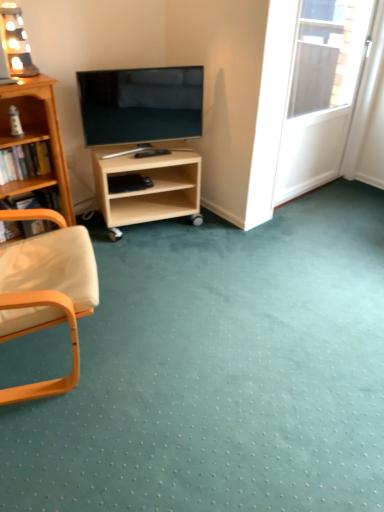
Question: Considering the positions of wooden lamp at upper left and wooden armchair at left in the image, is wooden lamp at upper left bigger or smaller than wooden armchair at left?

Choices:
 (A) big
 (B) small

Answer: (B)

Question: From a real-world perspective, relative to wooden armchair at left, is wooden lamp at upper left vertically above or below?

Choices:
 (A) below
 (B) above

Answer: (B)

Question: Which object is positioned closest to the wooden lamp at upper left?

Choices:
 (A) wooden bookshelf at left, the 2th book when ordered from bottom to top
 (B) wooden armchair at left
 (C) matte black tv at center
 (D) white glossy screen door at upper right
 (E) light wood/unfinishedobject at center

Answer: (A)

Question: Which is nearer to the matte black tv at center?

Choices:
 (A) wooden lamp at upper left
 (B) white glossy screen door at upper right
 (C) wooden bookcase at left
 (D) wooden bookshelf at left, the 2th book when ordered from bottom to top
 (E) wooden chair arm at left, which is counted as the second book, starting from the top

Answer: (C)